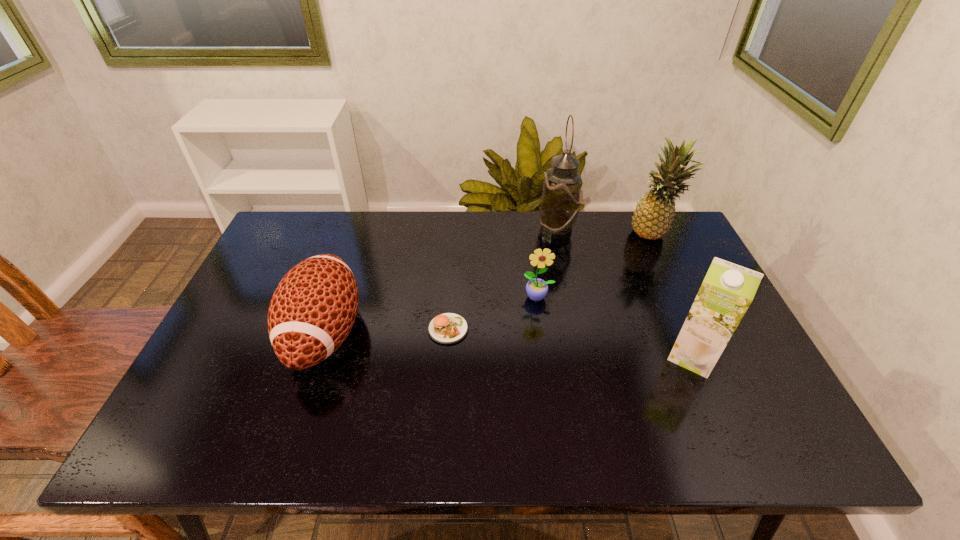
Identify the location of blank area located on the right of the football. Image resolution: width=960 pixels, height=540 pixels. (501, 333).

Find the location of a particular element. The height and width of the screenshot is (540, 960). blank space located on the front-facing side of the sunflower is located at coordinates point(552,397).

At what (x,y) coordinates should I click in order to perform the action: click on vacant space located on the left of the patty. Please return your answer as a coordinate pair (x, y). Looking at the image, I should click on (291, 329).

I want to click on oil lamp located in the far edge section of the desktop, so click(x=560, y=201).

Find the location of a particular element. The height and width of the screenshot is (540, 960). pineapple located at the far edge is located at coordinates (652, 218).

Where is `pineapple located at the right edge`? The width and height of the screenshot is (960, 540). pineapple located at the right edge is located at coordinates (652, 218).

Locate an element on the screen. soya milk located in the right edge section of the desktop is located at coordinates (728, 289).

This screenshot has width=960, height=540. Identify the location of object that is at the far right corner. (652, 218).

In the image, there is a desktop. Where is `free space at the far edge`? This screenshot has height=540, width=960. free space at the far edge is located at coordinates (607, 220).

Image resolution: width=960 pixels, height=540 pixels. What are the coordinates of `blank area at the near edge` in the screenshot? It's located at (296, 428).